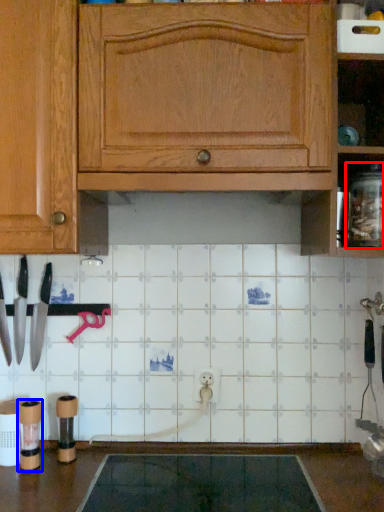
Question: Which point is closer to the camera, glass jar (highlighted by a red box) or appliance (highlighted by a blue box)?

Choices:
 (A) glass jar
 (B) appliance

Answer: (A)